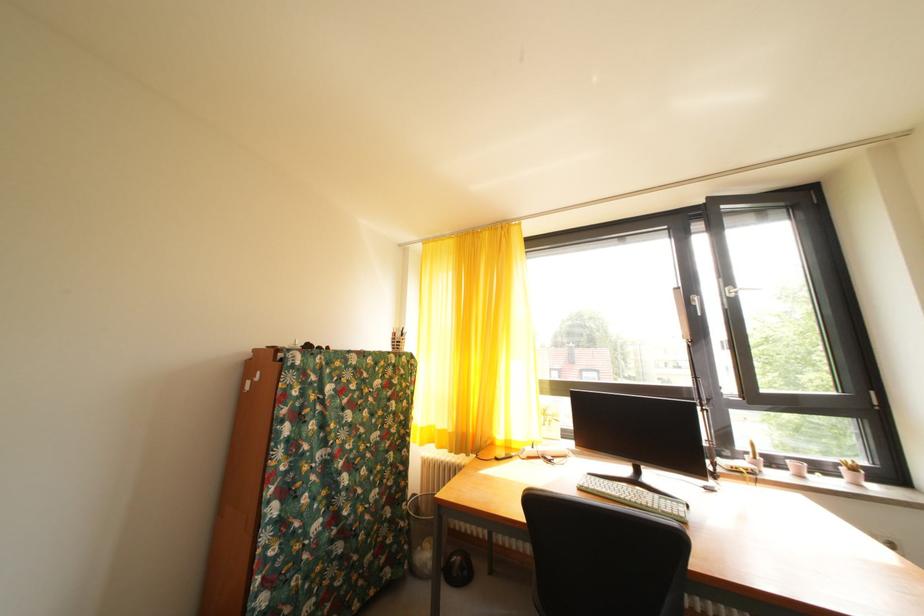
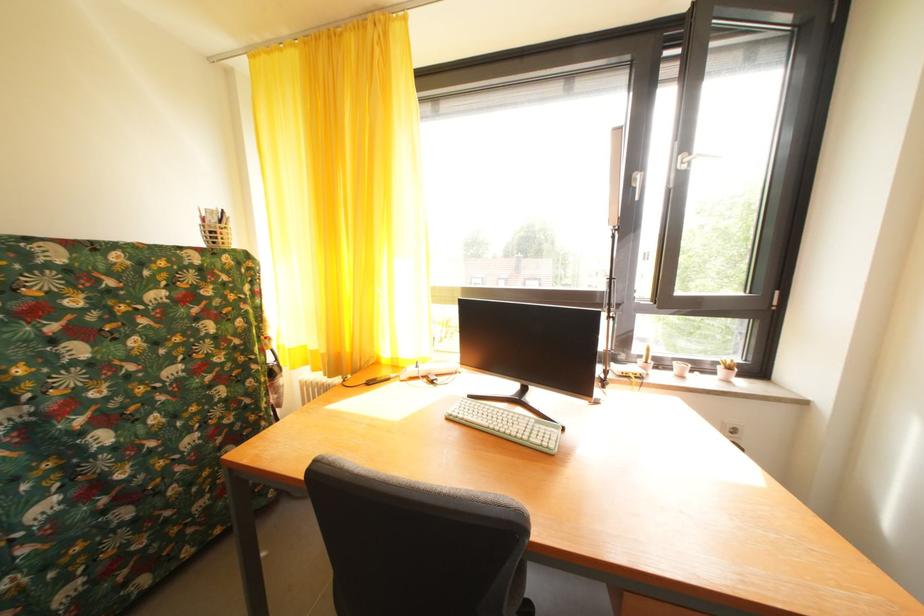
Where in the second image is the point corresponding to point (853, 476) from the first image?

(728, 374)